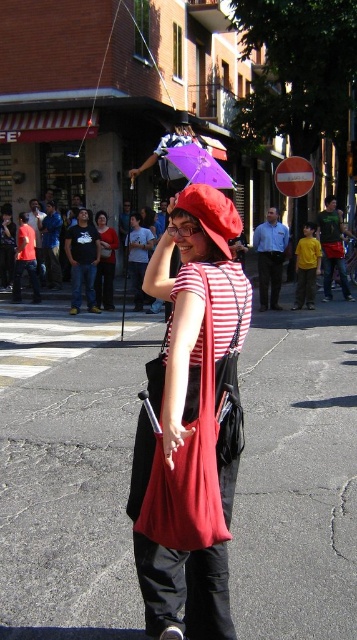
Question: Can you confirm if matte red bag at center is positioned above red fabric hat at center?

Choices:
 (A) yes
 (B) no

Answer: (B)

Question: Which point is farther from the camera taking this photo?

Choices:
 (A) [193, 209]
 (B) [177, 204]
 (C) [103, 227]
 (D) [219, 186]

Answer: (C)

Question: Is red fabric hat at center closer to the viewer compared to matte black shirt at center?

Choices:
 (A) no
 (B) yes

Answer: (B)

Question: Can you confirm if matte red bag at center is wider than matte black shirt at center?

Choices:
 (A) no
 (B) yes

Answer: (B)

Question: Based on their relative distances, which object is farther from the red fabric hat at center?

Choices:
 (A) purple glossy umbrella at center
 (B) matte red bag at center
 (C) matte black shirt at center

Answer: (C)

Question: Estimate the real-world distances between objects in this image. Which object is closer to the purple glossy umbrella at center?

Choices:
 (A) red fabric hat at center
 (B) matte red bag at center
 (C) matte black shirt at center

Answer: (A)